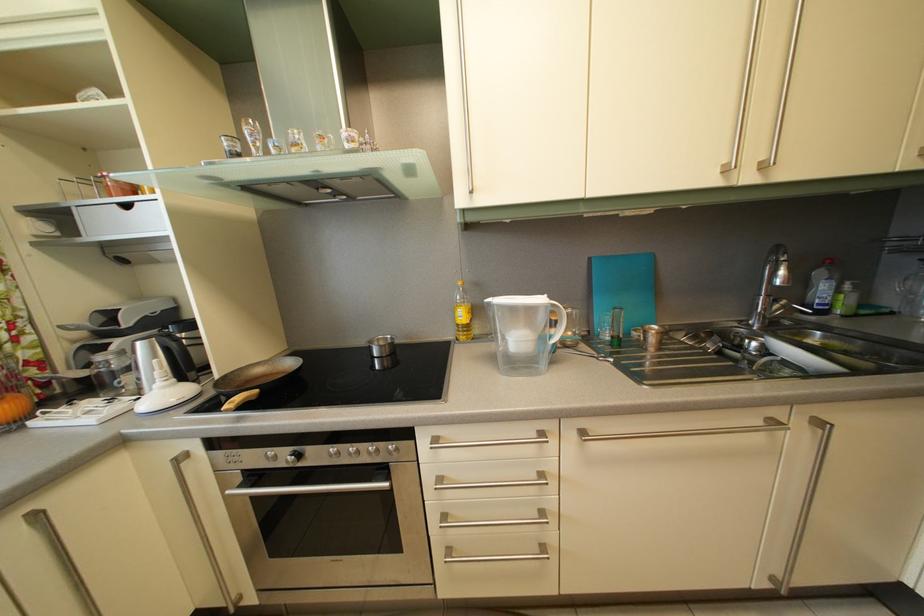
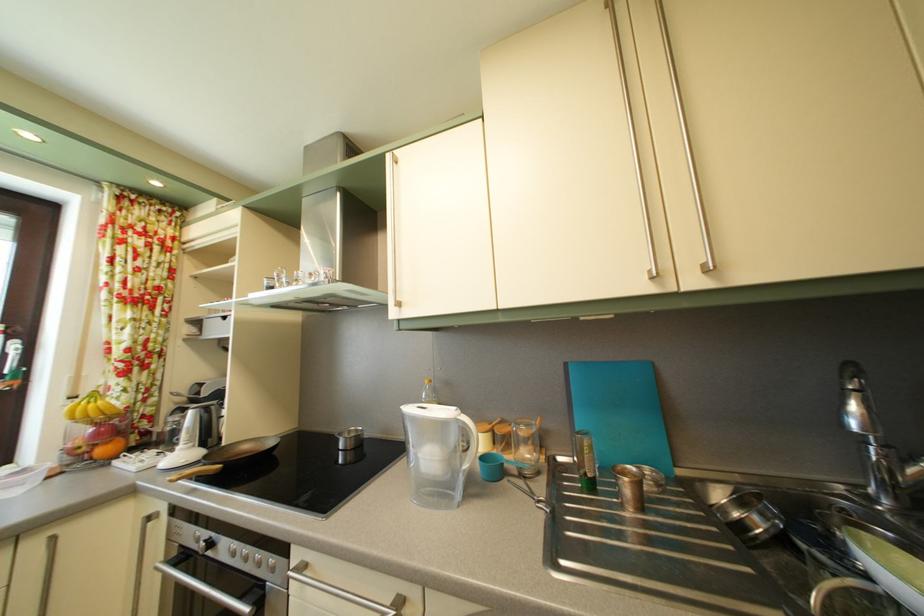
The images are taken continuously from a first-person perspective. In which direction is your viewpoint rotating?

The camera's rotation is toward left-up.